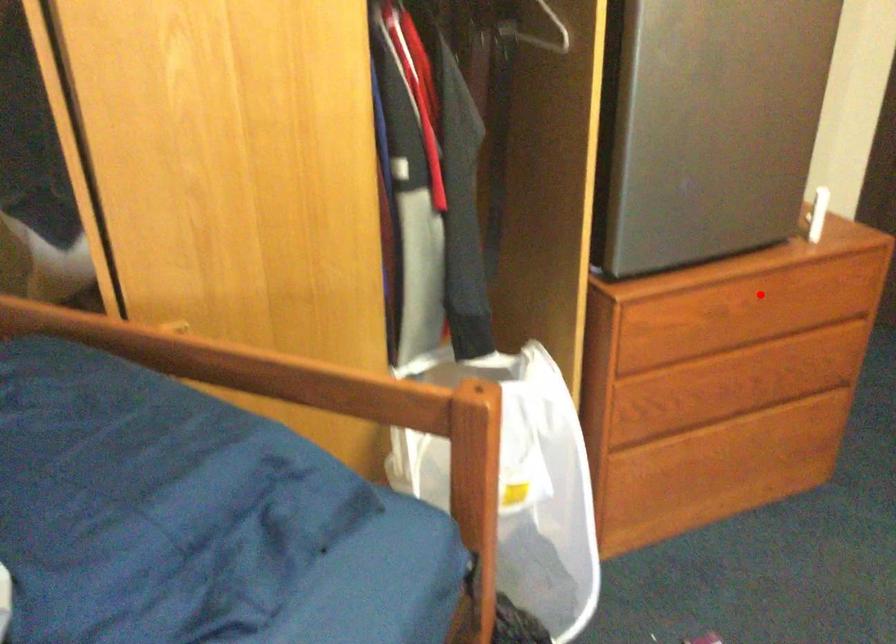
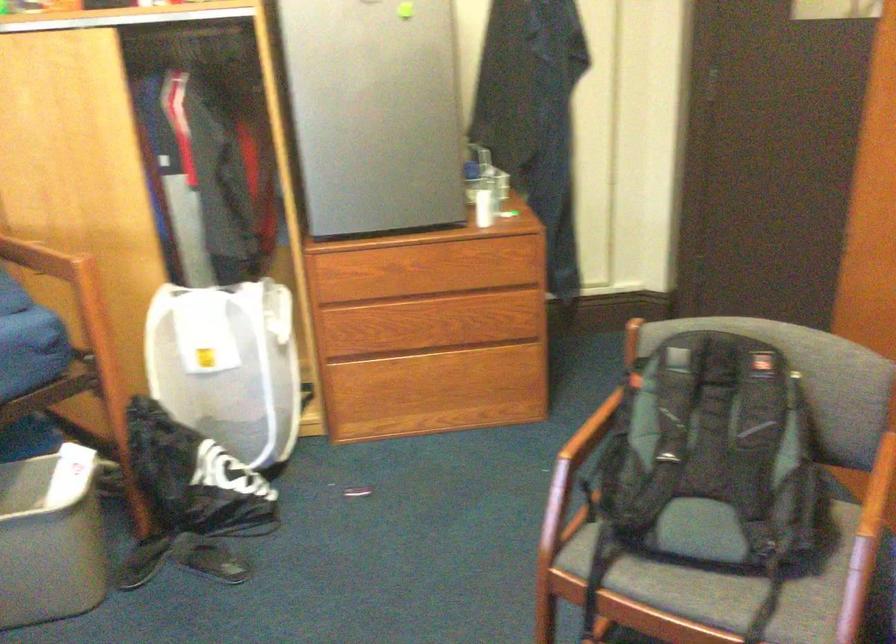
In the second image, find the point that corresponds to the highlighted location in the first image.

(440, 266)